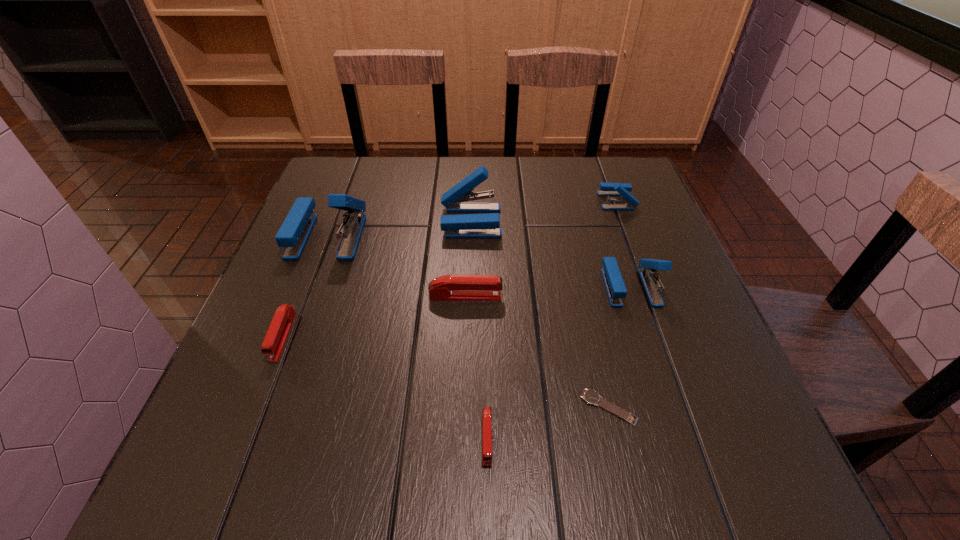
Find the location of a particular element. The height and width of the screenshot is (540, 960). free point located on the front-facing side of the farthest red stapler is located at coordinates (568, 296).

This screenshot has width=960, height=540. I want to click on vacant space situated 0.060m on the front-facing side of the sixth farthest object, so click(x=261, y=392).

Identify the location of free point located 0.110m on the back of the watch. (593, 339).

The width and height of the screenshot is (960, 540). In order to click on object at the near edge in this screenshot , I will do `click(486, 410)`.

Locate an element on the screen. object that is at the far right corner is located at coordinates (630, 202).

Where is `free space at the far edge of the desktop`? free space at the far edge of the desktop is located at coordinates (417, 158).

Where is `vacant space at the near edge of the desktop`? This screenshot has height=540, width=960. vacant space at the near edge of the desktop is located at coordinates (328, 464).

Identify the location of free point at the left edge. (260, 343).

Locate an element on the screen. The width and height of the screenshot is (960, 540). free spot at the right edge of the desktop is located at coordinates (665, 228).

You are a GUI agent. You are given a task and a screenshot of the screen. Output one action in this format:
    pyautogui.click(x=<x>, y=<y>)
    Task: Click on the vacant space at the far left corner
    The width and height of the screenshot is (960, 540).
    Given the screenshot: What is the action you would take?
    pyautogui.click(x=351, y=175)